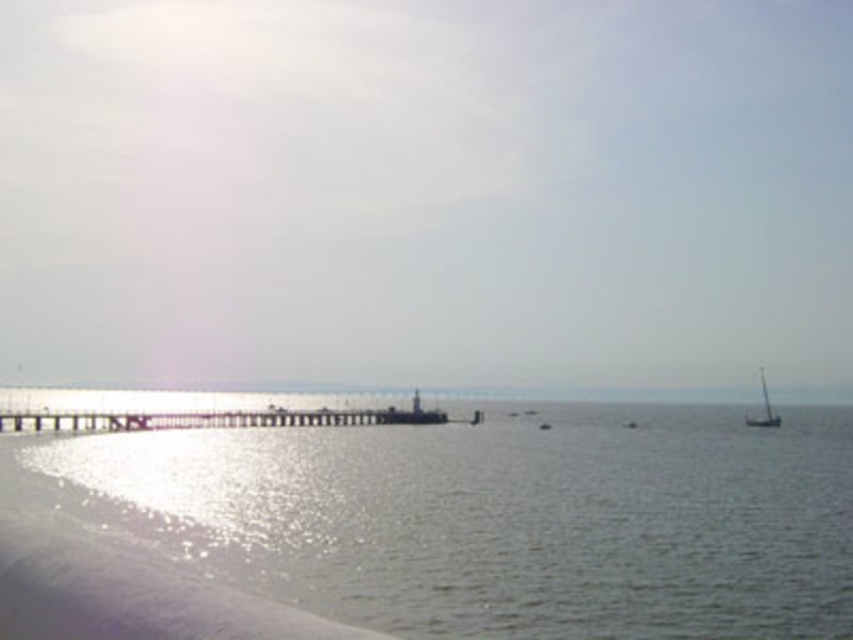
You are standing on the pier and want to place a small decorative boat in the water. The boat requires a water surface that is wider than the other. Which area should you choose between the shiny silver water at lower left and the smooth glass water at center?

The smooth glass water at center is wider than the shiny silver water at lower left, so you should choose the smooth glass water at center to place the boat.

You are standing at the edge of the curved white structure in the foreground of the coastal scene. You notice a point marked at coordinates (201, 392). What type of surface would you expect to find there?

At point (201, 392) lies smooth glass water at center, so you would expect to find smooth glass water there.